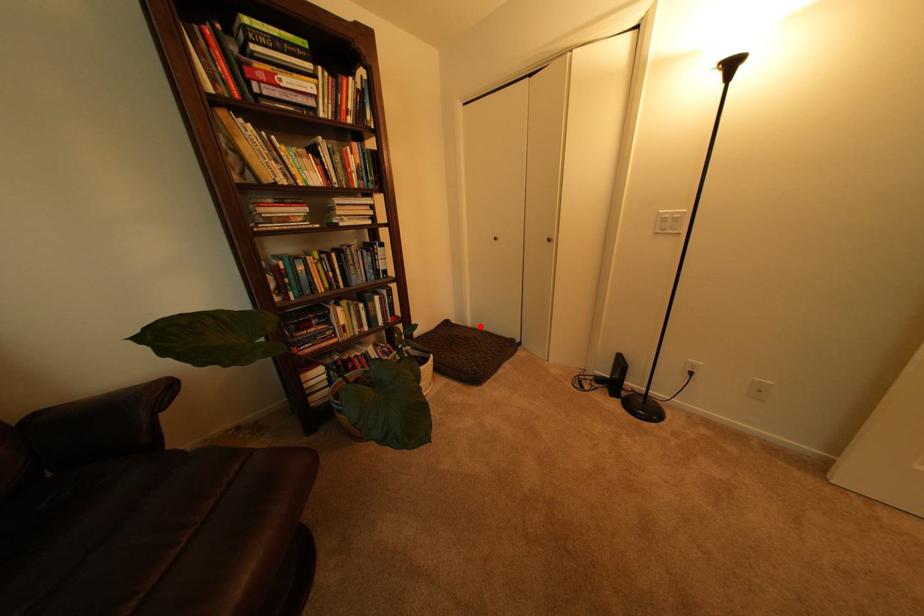
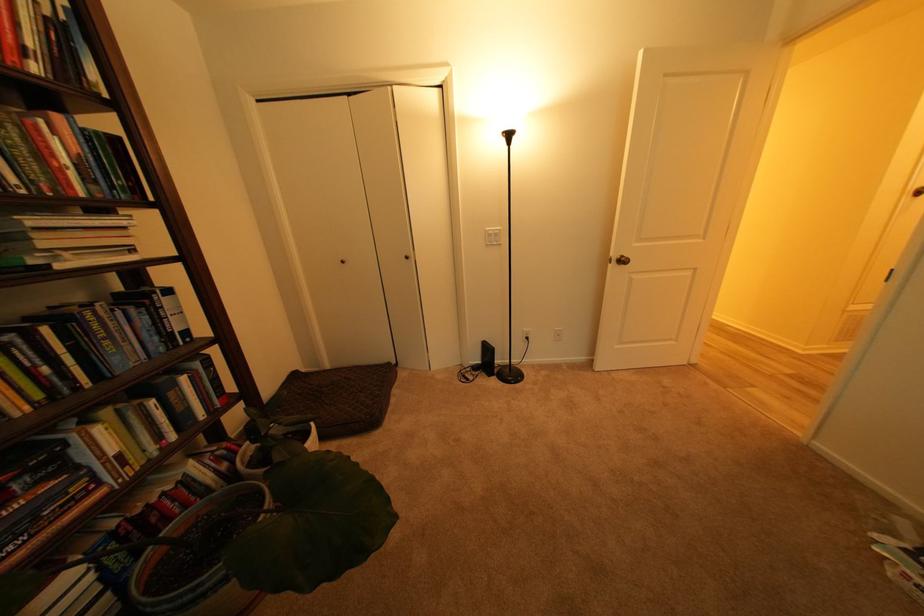
Question: I am providing you with two images of the same scene from different viewpoints. A red point is marked on the first image. Is the red point's position out of view in image 2?

Choices:
 (A) Yes
 (B) No

Answer: (B)